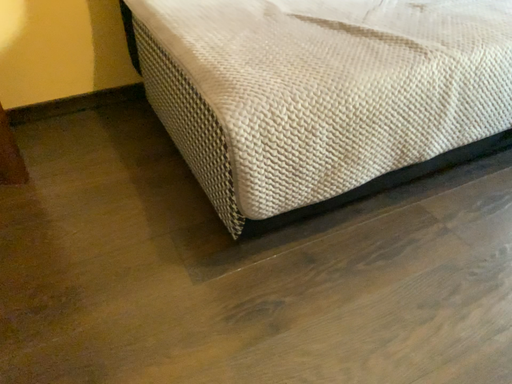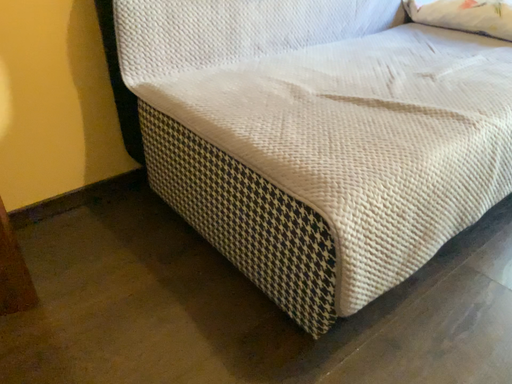
Question: Which way did the camera rotate in the video?

Choices:
 (A) rotated left
 (B) rotated right

Answer: (B)